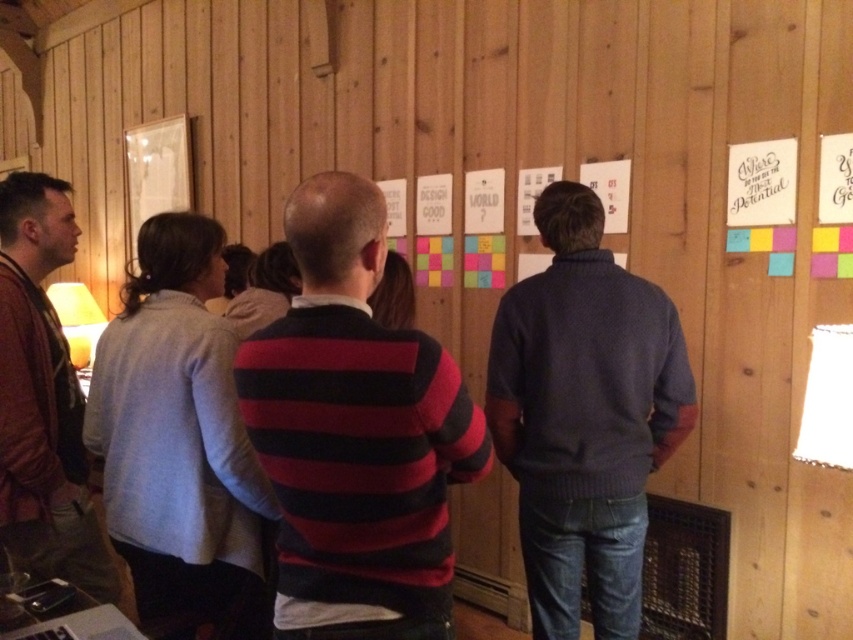
Question: Estimate the real-world distances between objects in this image. Which object is farther from the striped sweater at center?

Choices:
 (A) dark blue sweater at center
 (B) leather jacket at left

Answer: (B)

Question: Can you confirm if striped sweater at center is wider than dark blue sweater at center?

Choices:
 (A) no
 (B) yes

Answer: (A)

Question: Can you confirm if striped sweater at center is positioned below leather jacket at left?

Choices:
 (A) no
 (B) yes

Answer: (A)

Question: Which is nearer to the dark blue sweater at center?

Choices:
 (A) striped sweater at center
 (B) leather jacket at left

Answer: (A)

Question: Does striped sweater at center have a smaller size compared to dark blue sweater at center?

Choices:
 (A) yes
 (B) no

Answer: (A)

Question: Which point is farther from the camera taking this photo?

Choices:
 (A) (263, 452)
 (B) (4, 490)
 (C) (567, 624)

Answer: (C)